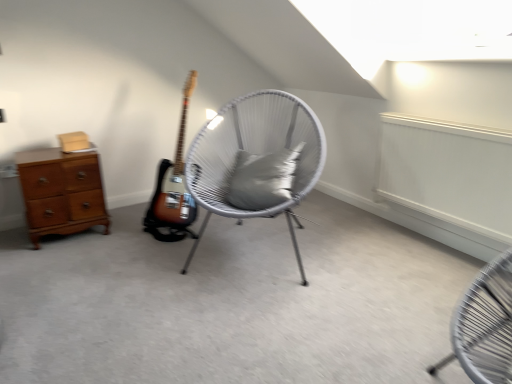
Identify the location of vacant area located to the right-hand side of wooden chest of drawers at left. The height and width of the screenshot is (384, 512). (120, 231).